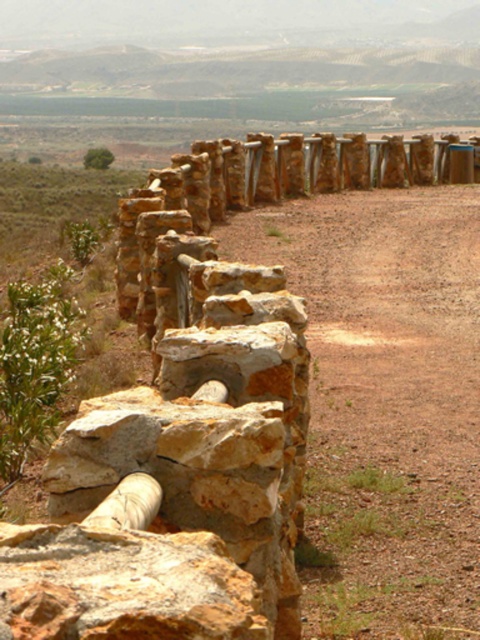
Question: Observing the image, what is the correct spatial positioning of brown gravel path at center in reference to rusty stone wall at center?

Choices:
 (A) below
 (B) above

Answer: (B)

Question: Can you confirm if brown gravel path at center is positioned above rusty stone wall at center?

Choices:
 (A) yes
 (B) no

Answer: (A)

Question: Does brown gravel path at center appear over rusty stone wall at center?

Choices:
 (A) no
 (B) yes

Answer: (B)

Question: Which object is farther from the camera taking this photo?

Choices:
 (A) brown gravel path at center
 (B) rusty stone wall at center

Answer: (A)

Question: Which point is farther to the camera?

Choices:
 (A) brown gravel path at center
 (B) rusty stone wall at center

Answer: (A)